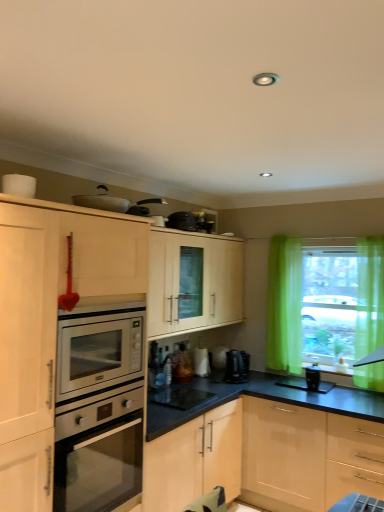
Find the location of a particular element. unoccupied space behind black glossy coffee maker at center, which is the first appliance from bottom to top is located at coordinates [204, 388].